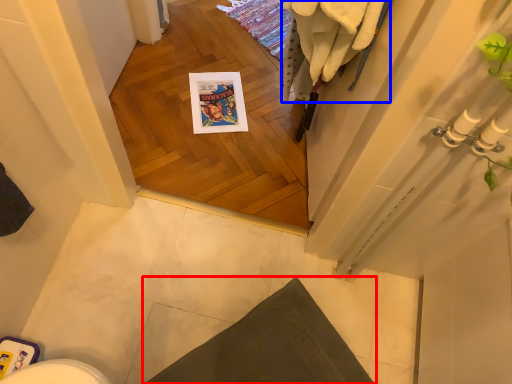
Question: Which of the following is the closest to the observer, bath mat (highlighted by a red box) or bath towel (highlighted by a blue box)?

Choices:
 (A) bath mat
 (B) bath towel

Answer: (B)